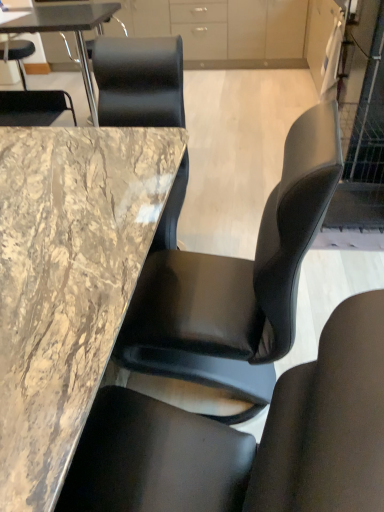
Describe the element at coordinates (68, 31) in the screenshot. I see `marble/black at upper left, the 2th table from the bottom` at that location.

This screenshot has width=384, height=512. Find the location of `black leather chair at upper left, which is the first chair from back to front`. black leather chair at upper left, which is the first chair from back to front is located at coordinates (20, 54).

Find the location of a particular element. The width and height of the screenshot is (384, 512). matte white cabinet at upper center, the second cabinetry in the front-to-back sequence is located at coordinates (230, 30).

The width and height of the screenshot is (384, 512). Find the location of `marble/black at upper left, the 1th table from the back`. marble/black at upper left, the 1th table from the back is located at coordinates (68, 31).

Considering the relative sizes of marble table at center, which is the second table from back to front, and marble/black at upper left, which is counted as the 2th table, starting from the front, in the image provided, is marble table at center, which is the second table from back to front, bigger than marble/black at upper left, which is counted as the 2th table, starting from the front,?

Correct, marble table at center, which is the second table from back to front, is larger in size than marble/black at upper left, which is counted as the 2th table, starting from the front.

Is point (102, 328) positioned behind point (86, 14)?

No, (102, 328) is in front of (86, 14).

Does marble table at center, the first table from the front, have a greater height compared to marble/black at upper left, the 2th table from the bottom?

Incorrect, the height of marble table at center, the first table from the front, is not larger of that of marble/black at upper left, the 2th table from the bottom.

From the image's perspective, between marble table at center, the second table viewed from the top, and marble/black at upper left, the 1th table from the back, who is located below?

marble table at center, the second table viewed from the top, from the image's perspective.

Is black leather chair at upper left, placed as the 1th chair when sorted from left to right, bigger or smaller than matte white cabinet at upper center, the second cabinetry in the front-to-back sequence?

Clearly, black leather chair at upper left, placed as the 1th chair when sorted from left to right, is smaller in size than matte white cabinet at upper center, the second cabinetry in the front-to-back sequence.

Is black leather chair at upper left, which is counted as the 2th chair, starting from the bottom, not near matte white cabinet at upper center, which is the second cabinetry in bottom-to-top order?

Yes, black leather chair at upper left, which is counted as the 2th chair, starting from the bottom, and matte white cabinet at upper center, which is the second cabinetry in bottom-to-top order, are located far from each other.

Considering the relative positions of black leather chair at upper left, the first chair when ordered from top to bottom, and matte white cabinet at upper center, the 1th cabinetry in the back-to-front sequence, in the image provided, is black leather chair at upper left, the first chair when ordered from top to bottom, to the left of matte white cabinet at upper center, the 1th cabinetry in the back-to-front sequence, from the viewer's perspective?

Indeed, black leather chair at upper left, the first chair when ordered from top to bottom, is positioned on the left side of matte white cabinet at upper center, the 1th cabinetry in the back-to-front sequence.

Based on the photo, between marble/black at upper left, the 2th table from the bottom, and black leather chair at center, placed as the 2th chair when sorted from top to bottom, which one has larger width?

black leather chair at center, placed as the 2th chair when sorted from top to bottom.

Is point (79, 36) more distant than point (273, 418)?

Yes, it is.

Could you tell me if marble/black at upper left, the 1th table from the back, is facing black leather chair at center, the first chair in the front-to-back sequence?

Yes, marble/black at upper left, the 1th table from the back, is aimed at black leather chair at center, the first chair in the front-to-back sequence.

Identify the location of chair in front of the black leather chair at upper left, which is the first chair from back to front. Image resolution: width=384 pixels, height=512 pixels. (249, 439).

Is black leather chair at upper left, which is counted as the 2th chair, starting from the bottom, located outside black leather chair at center, the 2th chair in the left-to-right sequence?

black leather chair at upper left, which is counted as the 2th chair, starting from the bottom, lies outside black leather chair at center, the 2th chair in the left-to-right sequence,'s area.

Between black leather chair at upper left, which is counted as the 2th chair, starting from the bottom, and black leather chair at center, the 2th chair in the left-to-right sequence, which one is positioned behind?

Positioned behind is black leather chair at upper left, which is counted as the 2th chair, starting from the bottom.

Considering the positions of objects matte white cabinet at upper right, which is counted as the first cabinetry, starting from the bottom, and matte white cabinet at upper center, which is the second cabinetry in bottom-to-top order, in the image provided, who is behind, matte white cabinet at upper right, which is counted as the first cabinetry, starting from the bottom, or matte white cabinet at upper center, which is the second cabinetry in bottom-to-top order,?

matte white cabinet at upper center, which is the second cabinetry in bottom-to-top order, is behind.

Can you confirm if matte white cabinet at upper right, arranged as the first cabinetry when viewed from the right, is positioned to the right of matte white cabinet at upper center, the 1th cabinetry in the top-to-bottom sequence?

Yes, matte white cabinet at upper right, arranged as the first cabinetry when viewed from the right, is to the right of matte white cabinet at upper center, the 1th cabinetry in the top-to-bottom sequence.

From the image's perspective, which is above, matte white cabinet at upper right, the second cabinetry viewed from the top, or matte white cabinet at upper center, which is the second cabinetry in bottom-to-top order?

From the image's view, matte white cabinet at upper center, which is the second cabinetry in bottom-to-top order, is above.

Looking at this image, is matte white cabinet at upper right, the 2th cabinetry from the left, inside the boundaries of matte white cabinet at upper center, which is the 1th cabinetry in left-to-right order, or outside?

matte white cabinet at upper right, the 2th cabinetry from the left, lies outside matte white cabinet at upper center, which is the 1th cabinetry in left-to-right order.

From the black leather chair at upper left, which is counted as the 2th chair, starting from the bottom, count 1st table to the right and point to it. Please provide its 2D coordinates.

[(68, 31)]

From the picture: Is black leather chair at upper left, acting as the second chair starting from the front, spatially inside marble/black at upper left, the 2th table from the bottom, or outside of it?

black leather chair at upper left, acting as the second chair starting from the front, lies outside marble/black at upper left, the 2th table from the bottom.

Does black leather chair at upper left, which is counted as the 2th chair, starting from the bottom, lie in front of marble/black at upper left, the 1th table from the back?

No, black leather chair at upper left, which is counted as the 2th chair, starting from the bottom, is behind marble/black at upper left, the 1th table from the back.

Which object is thinner, matte white cabinet at upper right, which is counted as the first cabinetry, starting from the bottom, or marble/black at upper left, the 1th table from the back?

matte white cabinet at upper right, which is counted as the first cabinetry, starting from the bottom.

From the image's perspective, between matte white cabinet at upper right, marked as the 2th cabinetry in a back-to-front arrangement, and marble/black at upper left, the first table from the top, which one is located above?

matte white cabinet at upper right, marked as the 2th cabinetry in a back-to-front arrangement, from the image's perspective.

In the scene shown: Does matte white cabinet at upper right, which is counted as the 1th cabinetry, starting from the front, contain marble/black at upper left, the 1th table from the back?

Actually, marble/black at upper left, the 1th table from the back, is outside matte white cabinet at upper right, which is counted as the 1th cabinetry, starting from the front.

Locate an element on the screen. The height and width of the screenshot is (512, 384). table in front of the marble/black at upper left, the 2th table from the bottom is located at coordinates (67, 283).

What are the coordinates of `chair directly beneath the matte white cabinet at upper center, the second cabinetry in the front-to-back sequence (from a real-world perspective)` in the screenshot? It's located at (20, 54).

Which object lies nearer to the anchor point marble table at center, the second table viewed from the top, matte white cabinet at upper center, the 1th cabinetry in the top-to-bottom sequence, or black leather chair at center, the first chair in the front-to-back sequence?

black leather chair at center, the first chair in the front-to-back sequence, lies closer to marble table at center, the second table viewed from the top, than the other object.

Based on their spatial positions, is black leather chair at center, the second chair positioned from the back, or matte white cabinet at upper center, the 1th cabinetry in the back-to-front sequence, further from marble/black at upper left, which is counted as the 2th table, starting from the front?

Among the two, black leather chair at center, the second chair positioned from the back, is located further to marble/black at upper left, which is counted as the 2th table, starting from the front.

When comparing their distances from matte white cabinet at upper right, the second cabinetry viewed from the top, does black leather chair at center, acting as the 1th chair starting from the right, or marble table at center, which appears as the first table when ordered from the bottom, seem further?

black leather chair at center, acting as the 1th chair starting from the right.

When comparing their distances from black leather chair at center, placed as the 2th chair when sorted from top to bottom, does marble table at center, the first table from the front, or matte white cabinet at upper right, the 2th cabinetry from the left, seem closer?

marble table at center, the first table from the front, is positioned closer to the anchor black leather chair at center, placed as the 2th chair when sorted from top to bottom.

Considering their positions, is matte white cabinet at upper right, marked as the 2th cabinetry in a back-to-front arrangement, positioned further to marble table at center, the first table from the front, than marble/black at upper left, which is counted as the 2th table, starting from the front?

matte white cabinet at upper right, marked as the 2th cabinetry in a back-to-front arrangement, is further to marble table at center, the first table from the front.

Estimate the real-world distances between objects in this image. Which object is further from matte white cabinet at upper center, which appears as the second cabinetry when viewed from the right, black leather chair at upper left, which is the first chair from back to front, or marble table at center, the second table viewed from the top?

marble table at center, the second table viewed from the top, lies further to matte white cabinet at upper center, which appears as the second cabinetry when viewed from the right, than the other object.

Considering their positions, is matte white cabinet at upper right, which is counted as the first cabinetry, starting from the bottom, positioned further to matte white cabinet at upper center, the 1th cabinetry in the top-to-bottom sequence, than black leather chair at upper left, placed as the 1th chair when sorted from left to right?

Based on the image, black leather chair at upper left, placed as the 1th chair when sorted from left to right, appears to be further to matte white cabinet at upper center, the 1th cabinetry in the top-to-bottom sequence.

Considering their positions, is matte white cabinet at upper right, arranged as the first cabinetry when viewed from the right, positioned closer to marble/black at upper left, the first table from the top, than matte white cabinet at upper center, the 1th cabinetry in the back-to-front sequence?

Among the two, matte white cabinet at upper center, the 1th cabinetry in the back-to-front sequence, is located nearer to marble/black at upper left, the first table from the top.

This screenshot has width=384, height=512. Identify the location of cabinetry situated between marble/black at upper left, the 1th table from the back, and matte white cabinet at upper right, arranged as the first cabinetry when viewed from the right, from left to right. (230, 30).

Where is `cabinetry positioned between marble table at center, which appears as the first table when ordered from the bottom, and matte white cabinet at upper center, which is the second cabinetry in bottom-to-top order, from near to far`? cabinetry positioned between marble table at center, which appears as the first table when ordered from the bottom, and matte white cabinet at upper center, which is the second cabinetry in bottom-to-top order, from near to far is located at coordinates (319, 34).

I want to click on table between black leather chair at center, the 2th chair in the left-to-right sequence, and marble/black at upper left, the first table from the top, from front to back, so click(x=67, y=283).

Image resolution: width=384 pixels, height=512 pixels. I want to click on cabinetry between black leather chair at center, the 2th chair in the left-to-right sequence, and matte white cabinet at upper center, the 1th cabinetry in the back-to-front sequence, from front to back, so click(x=319, y=34).